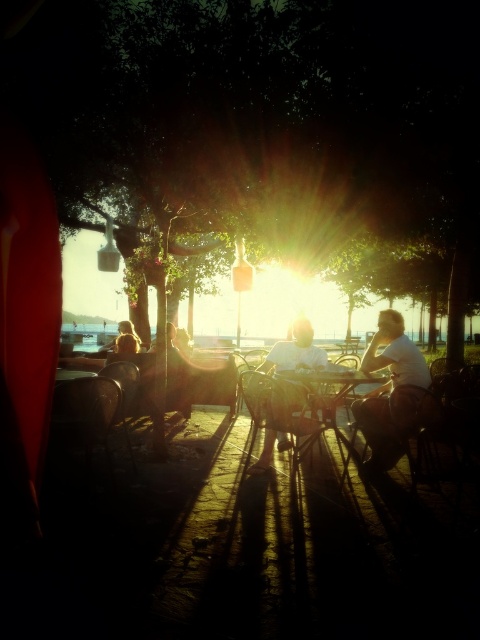
Question: Is metallic silver table at center further to the viewer compared to white shirt at center?

Choices:
 (A) no
 (B) yes

Answer: (A)

Question: Which object is the farthest from the white shirt at center?

Choices:
 (A) metallic silver chair at lower left
 (B) metallic silver table at center
 (C) blonde hair at left
 (D) white cotton shirt at right

Answer: (C)

Question: Where is white cotton shirt at right located in relation to blonde hair at left in the image?

Choices:
 (A) right
 (B) left

Answer: (A)

Question: Which of the following is the farthest from the observer?

Choices:
 (A) white cotton shirt at right
 (B) metallic silver table at center

Answer: (B)

Question: Does metallic silver chair at lower left appear under blonde hair at left?

Choices:
 (A) no
 (B) yes

Answer: (B)

Question: Among these points, which one is farthest from the camera?

Choices:
 (A) (422, 371)
 (B) (284, 438)

Answer: (B)